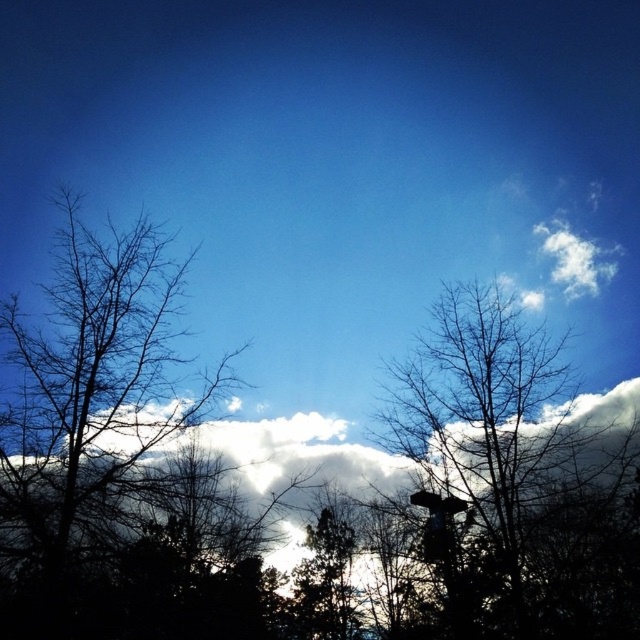
Between black bare tree at left and bare branches at center, which one appears on the right side from the viewer's perspective?

bare branches at center

Can you confirm if black bare tree at left is positioned to the left of bare branches at center?

Indeed, black bare tree at left is positioned on the left side of bare branches at center.

Which is behind, point (100, 369) or point (552, 556)?

The point (552, 556) is behind.

Locate an element on the screen. The width and height of the screenshot is (640, 640). black bare tree at left is located at coordinates (92, 392).